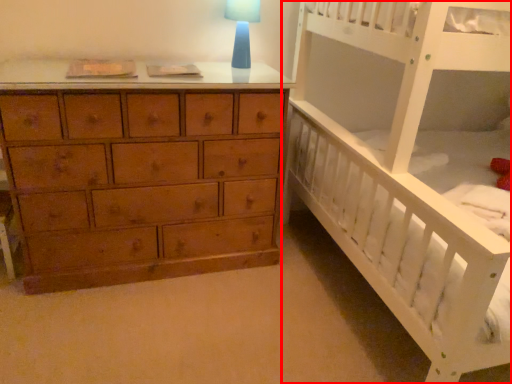
Question: From the image's perspective, what is the correct spatial positioning of infant bed (annotated by the red box) in reference to table lamp?

Choices:
 (A) above
 (B) below

Answer: (B)